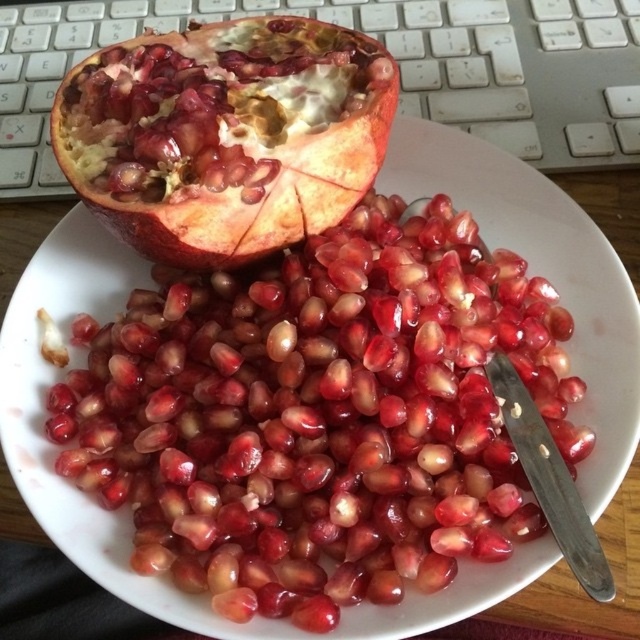
You are organizing items on a desk and need to place both the shiny red pomegranate seeds at center and the white plastic keyboard at upper center. Based on their sizes, which item should you place first to ensure enough space?

The shiny red pomegranate seeds at center has a lesser width compared to the white plastic keyboard at upper center, so you should place the white plastic keyboard at upper center first to accommodate its larger size and ensure there is enough space left for the smaller seeds.

You are organizing a fruit platter and need to place the matte red pomegranate at upper left and the white plastic keyboard at upper center. Since the keyboard is part of the background, can you move it to make space for the pomegranate?

The matte red pomegranate at upper left is smaller than the white plastic keyboard at upper center. Therefore, you can move the keyboard to accommodate the pomegranate since it is larger and might be easier to relocate.

You are a delivery robot that needs to place a small box on the table. The box is 22 inches long. You see the shiny red pomegranate seeds at center and the white plastic keyboard at upper center. Can the box fit between them?

The shiny red pomegranate seeds at center and the white plastic keyboard at upper center are 21.55 inches apart from each other. Since the box is 22 inches long, it cannot fit between them as the distance is slightly shorter than the box length.